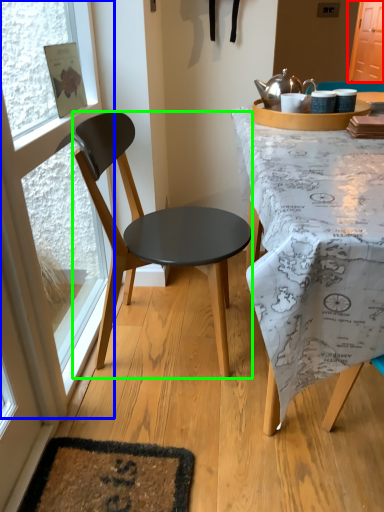
Question: Estimate the real-world distances between objects in this image. Which object is closer to screen door (highlighted by a red box), glass door (highlighted by a blue box) or chair (highlighted by a green box)?

Choices:
 (A) glass door
 (B) chair

Answer: (B)